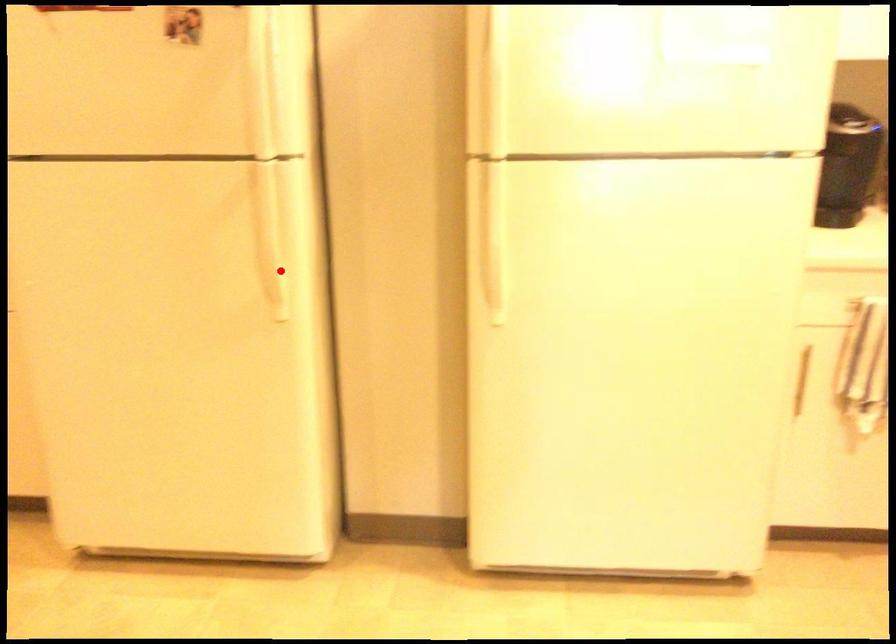
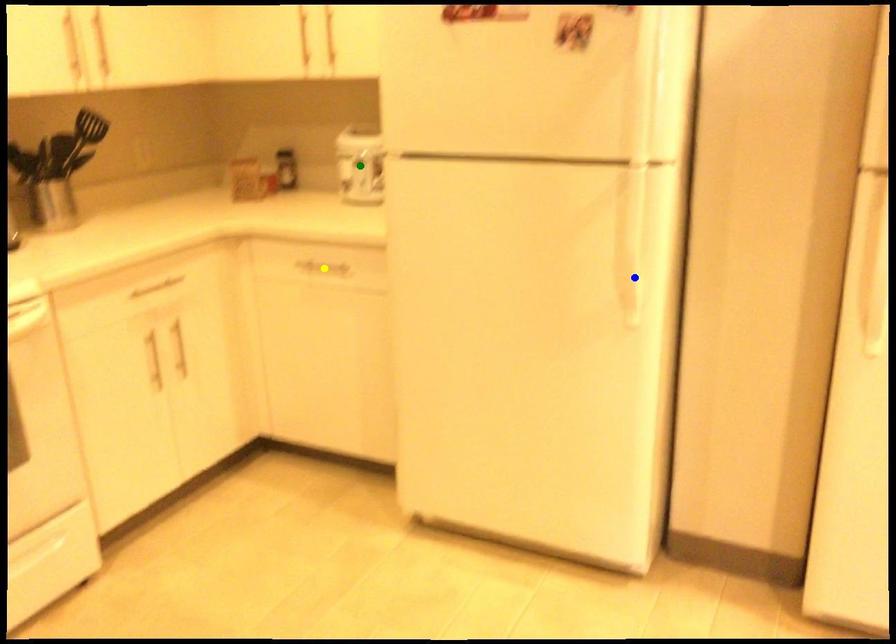
Question: I am providing you with two images of the same scene from different viewpoints. A red point is marked on the first image. You are given multiple points on the second image. Which point in image 2 represents the same 3d spot as the red point in image 1?

Choices:
 (A) yellow point
 (B) blue point
 (C) green point

Answer: (B)